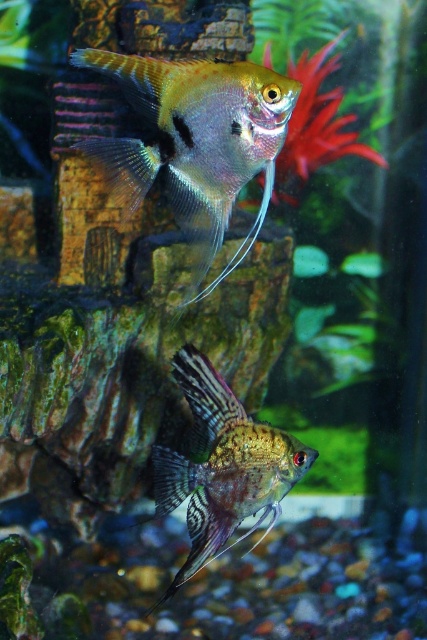
Question: Which object is closer to the camera taking this photo?

Choices:
 (A) translucent iridescent fish at upper center
 (B) shiny metallic fish at center

Answer: (A)

Question: Observing the image, what is the correct spatial positioning of translucent iridescent fish at upper center in reference to shiny metallic fish at center?

Choices:
 (A) above
 (B) below

Answer: (A)

Question: Among these objects, which one is farthest from the camera?

Choices:
 (A) translucent iridescent fish at upper center
 (B) shiny metallic fish at center

Answer: (B)

Question: Does translucent iridescent fish at upper center appear over shiny metallic fish at center?

Choices:
 (A) no
 (B) yes

Answer: (B)

Question: Does translucent iridescent fish at upper center have a larger size compared to shiny metallic fish at center?

Choices:
 (A) no
 (B) yes

Answer: (B)